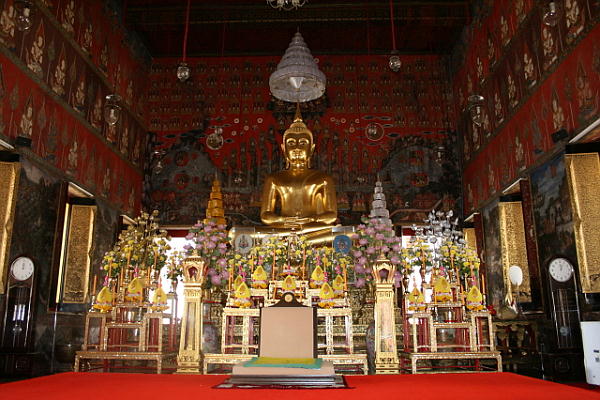
The width and height of the screenshot is (600, 400). Identify the location of red carpet. (122, 390).